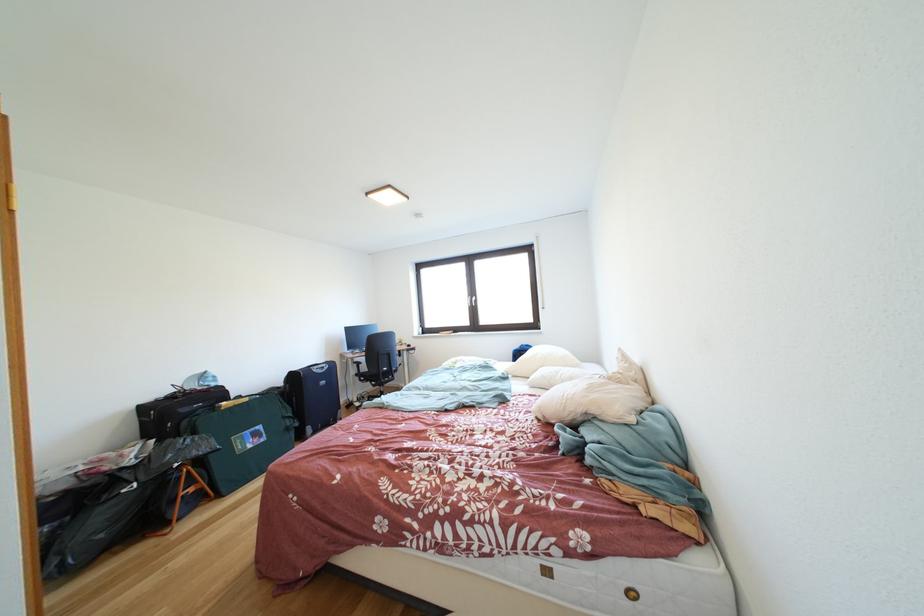
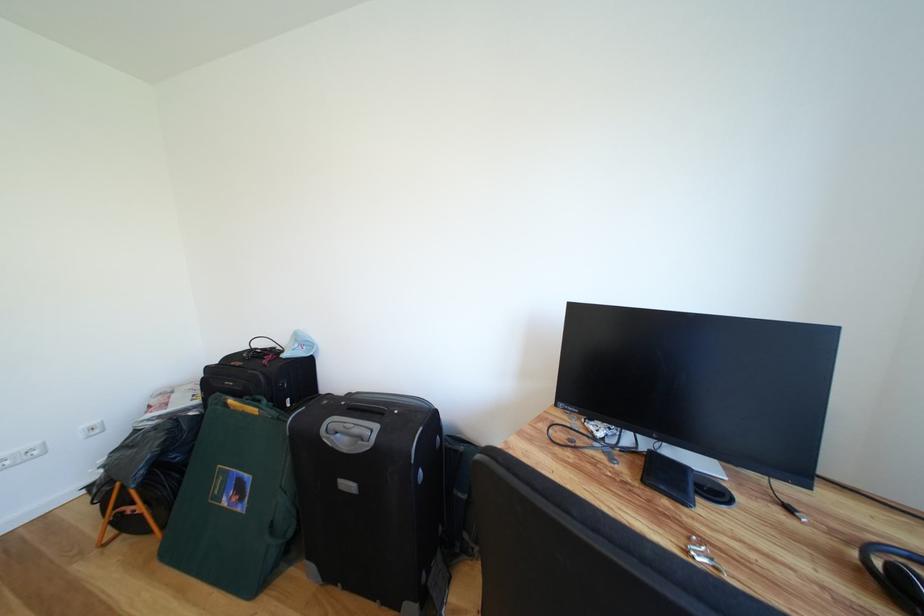
The point at (258, 451) is marked in the first image. Where is the corresponding point in the second image?

(234, 506)